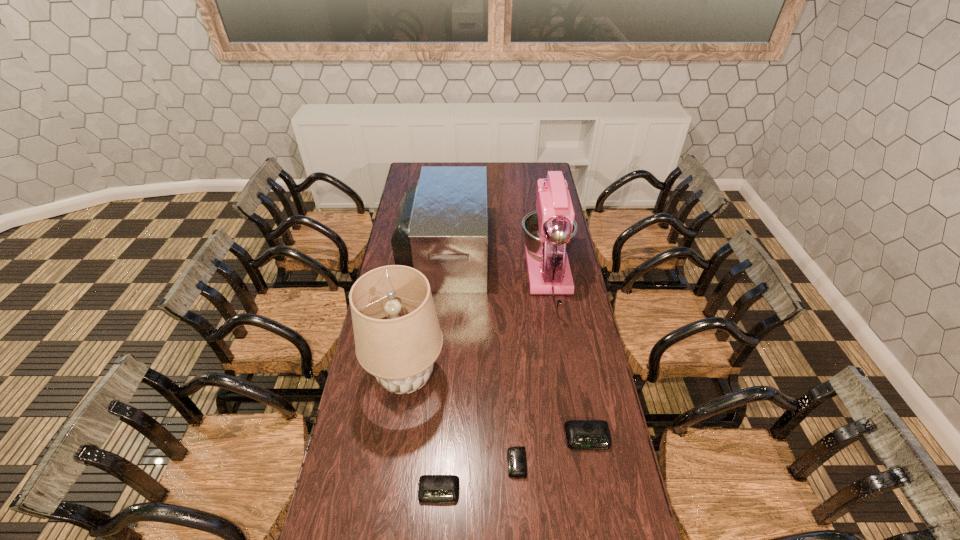
At what (x,y) coordinates should I click in order to perform the action: click on lampshade positioned at the left edge. Please return your answer as a coordinate pair (x, y). The image size is (960, 540). Looking at the image, I should click on (400, 351).

Locate an element on the screen. alarm clock located in the right edge section of the desktop is located at coordinates (580, 434).

At what (x,y) coordinates should I click in order to perform the action: click on mixer that is at the right edge. Please return your answer as a coordinate pair (x, y). The width and height of the screenshot is (960, 540). Looking at the image, I should click on pos(548,232).

I want to click on free region at the far edge of the desktop, so click(481, 164).

At what (x,y) coordinates should I click in order to perform the action: click on vacant space at the near edge of the desktop. Please return your answer as a coordinate pair (x, y). This screenshot has height=540, width=960. Looking at the image, I should click on (564, 502).

Locate an element on the screen. The image size is (960, 540). free space at the left edge of the desktop is located at coordinates (370, 465).

The image size is (960, 540). What are the coordinates of `vacant area at the right edge of the desktop` in the screenshot? It's located at (573, 420).

What are the coordinates of `vacant area that lies between the mixer and the tallest alarm clock` in the screenshot? It's located at (568, 359).

The image size is (960, 540). Identify the location of free spot between the tallest alarm clock and the microwave oven. (516, 345).

Where is `vacant space that is in between the second alarm clock from right to left and the second shortest alarm clock`? This screenshot has height=540, width=960. vacant space that is in between the second alarm clock from right to left and the second shortest alarm clock is located at coordinates (478, 477).